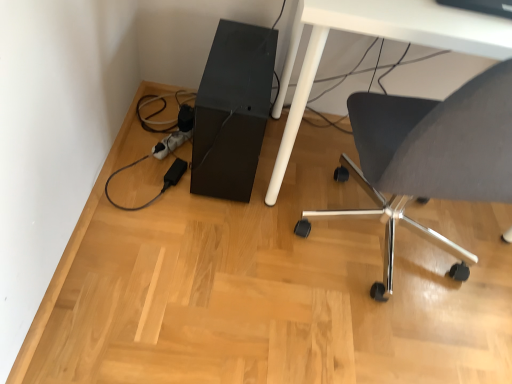
You are a GUI agent. You are given a task and a screenshot of the screen. Output one action in this format:
    pyautogui.click(x=<x>, y=<y>)
    Task: Click on the free space between matte gray chair at lower right and white glossy table at lower right
    The image size is (512, 384).
    Given the screenshot: What is the action you would take?
    pyautogui.click(x=396, y=261)